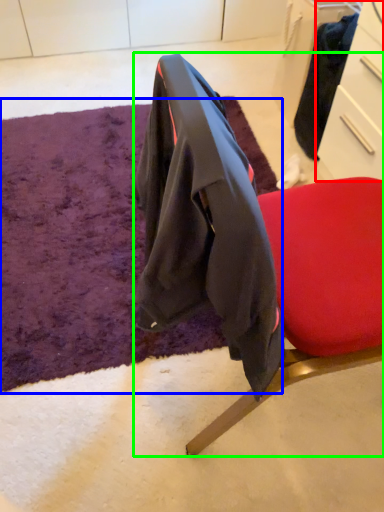
Question: Which object is the farthest from drawer (highlighted by a red box)? Choose among these: mat (highlighted by a blue box) or chair (highlighted by a green box).

Choices:
 (A) mat
 (B) chair

Answer: (A)